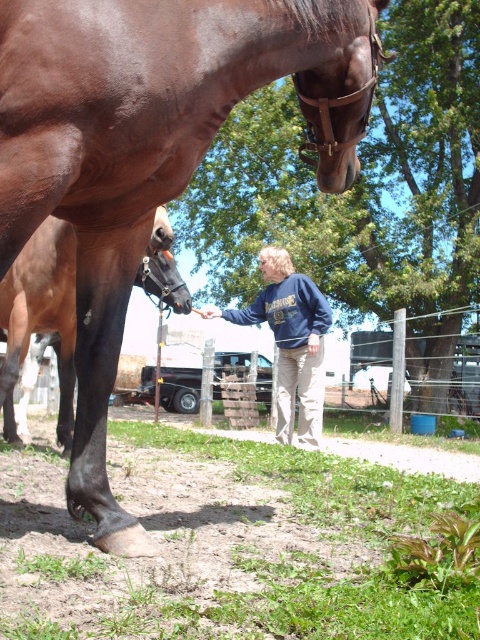
Question: Which point is closer to the camera?

Choices:
 (A) shiny brown horse at center
 (B) blue sweatshirt at center
 (C) black glossy horse leg at lower left

Answer: (A)

Question: Is shiny brown horse at center to the right of black glossy horse leg at lower left from the viewer's perspective?

Choices:
 (A) no
 (B) yes

Answer: (B)

Question: Is black glossy horse leg at lower left wider than blue sweatshirt at center?

Choices:
 (A) yes
 (B) no

Answer: (B)

Question: Which object appears closest to the camera in this image?

Choices:
 (A) shiny brown horse at center
 (B) blue sweatshirt at center

Answer: (A)

Question: Which point is closer to the camera?

Choices:
 (A) black glossy horse leg at lower left
 (B) shiny brown horse at center
 (C) blue sweatshirt at center

Answer: (B)

Question: Is black glossy horse leg at lower left below blue sweatshirt at center?

Choices:
 (A) no
 (B) yes

Answer: (A)